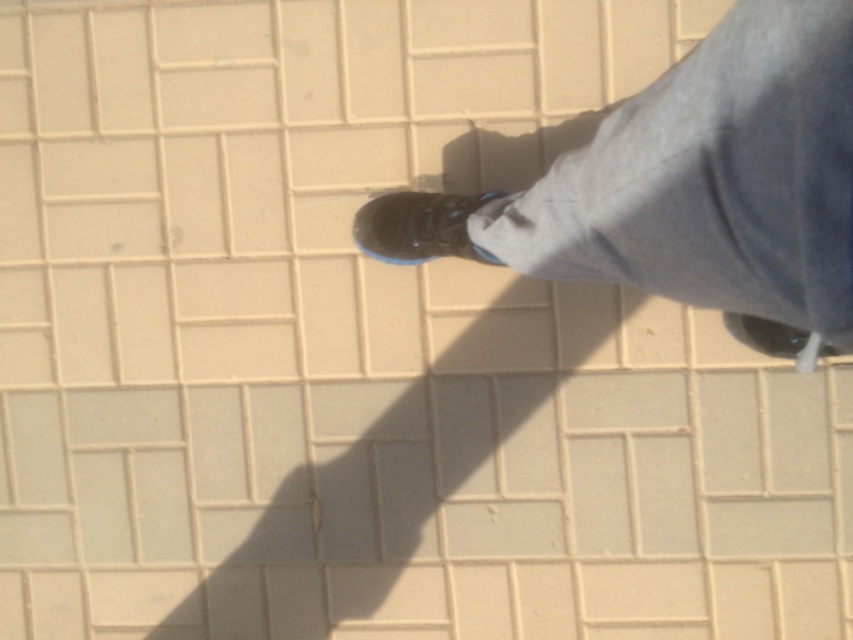
In the scene shown: Which is more to the right, black rubber shoe at center or shiny black shoe at center?

black rubber shoe at center is more to the right.

Is black rubber shoe at center closer to the viewer compared to shiny black shoe at center?

Yes.

Identify the location of black rubber shoe at center. (686, 182).

Between shiny black shoe at center and matte black shoe at lower right, which one has less height?

Standing shorter between the two is matte black shoe at lower right.

Is shiny black shoe at center shorter than matte black shoe at lower right?

Incorrect, shiny black shoe at center's height does not fall short of matte black shoe at lower right's.

Is point (468, 209) closer to viewer compared to point (772, 349)?

No, it is not.

This screenshot has height=640, width=853. In order to click on shiny black shoe at center in this screenshot , I will do `click(419, 227)`.

Can you confirm if black rubber shoe at center is taller than matte black shoe at lower right?

Yes, black rubber shoe at center is taller than matte black shoe at lower right.

Consider the image. Is black rubber shoe at center above matte black shoe at lower right?

Yes, black rubber shoe at center is above matte black shoe at lower right.

Does point (535, 234) lie behind point (776, 344)?

No, (535, 234) is in front of (776, 344).

The width and height of the screenshot is (853, 640). I want to click on black rubber shoe at center, so click(x=686, y=182).